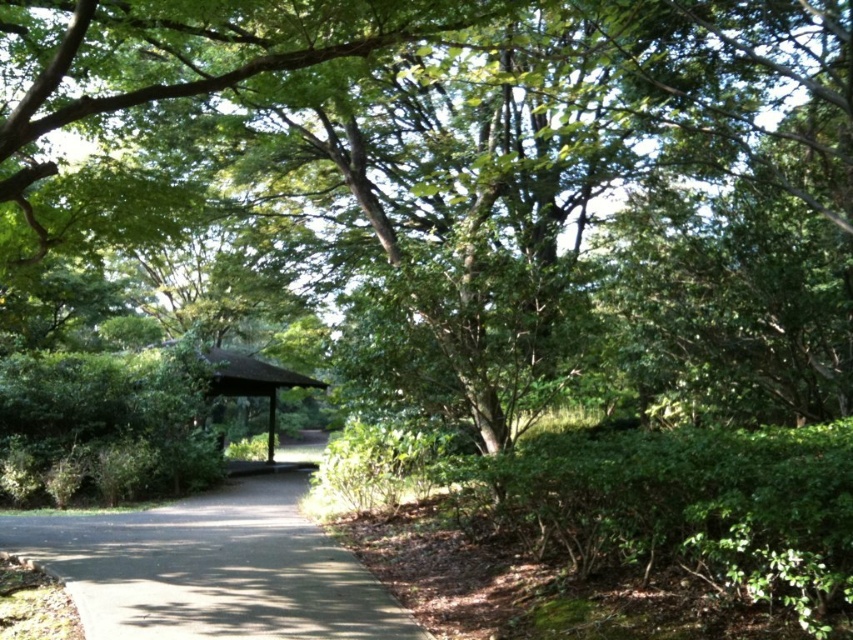
Question: Is dark gray asphalt at center behind brown wooden gazebo at center?

Choices:
 (A) yes
 (B) no

Answer: (B)

Question: Which point appears farthest from the camera in this image?

Choices:
 (A) (212, 545)
 (B) (250, 380)

Answer: (B)

Question: Is dark gray asphalt at center below brown wooden gazebo at center?

Choices:
 (A) yes
 (B) no

Answer: (A)

Question: Is dark gray asphalt at center positioned behind brown wooden gazebo at center?

Choices:
 (A) yes
 (B) no

Answer: (B)